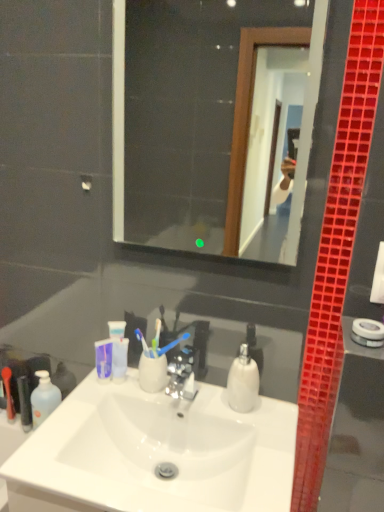
Question: Can you confirm if rubberized red toothbrush at lower left, which appears as the 1th toiletry when viewed from the left, is shorter than black plastic tube at left, the 1th toiletry when ordered from right to left?

Choices:
 (A) no
 (B) yes

Answer: (B)

Question: Can you confirm if rubberized red toothbrush at lower left, marked as the 2th toiletry in a right-to-left arrangement, is thinner than black plastic tube at left, the second toiletry viewed from the left?

Choices:
 (A) no
 (B) yes

Answer: (B)

Question: Are rubberized red toothbrush at lower left, which appears as the 1th toiletry when viewed from the left, and black plastic tube at left, the 1th toiletry when ordered from right to left, making contact?

Choices:
 (A) yes
 (B) no

Answer: (A)

Question: Does rubberized red toothbrush at lower left, marked as the 2th toiletry in a right-to-left arrangement, appear on the right side of black plastic tube at left, the 1th toiletry when ordered from right to left?

Choices:
 (A) yes
 (B) no

Answer: (B)

Question: Is rubberized red toothbrush at lower left, which appears as the 1th toiletry when viewed from the left, looking in the opposite direction of black plastic tube at left, the 1th toiletry when ordered from right to left?

Choices:
 (A) yes
 (B) no

Answer: (B)

Question: From a real-world perspective, is rubberized red toothbrush at lower left, marked as the 2th toiletry in a right-to-left arrangement, positioned under black plastic tube at left, the 1th toiletry when ordered from right to left, based on gravity?

Choices:
 (A) no
 (B) yes

Answer: (B)

Question: Considering the relative positions of white plastic towel bar at right and transparent glass mirror at upper center in the image provided, is white plastic towel bar at right to the right of transparent glass mirror at upper center from the viewer's perspective?

Choices:
 (A) no
 (B) yes

Answer: (B)

Question: Is white plastic towel bar at right not near transparent glass mirror at upper center?

Choices:
 (A) yes
 (B) no

Answer: (A)

Question: Is white plastic towel bar at right in contact with transparent glass mirror at upper center?

Choices:
 (A) yes
 (B) no

Answer: (B)

Question: Is white plastic towel bar at right thinner than transparent glass mirror at upper center?

Choices:
 (A) no
 (B) yes

Answer: (A)

Question: Does white plastic towel bar at right have a smaller size compared to transparent glass mirror at upper center?

Choices:
 (A) no
 (B) yes

Answer: (B)

Question: From a real-world perspective, is white plastic towel bar at right positioned under transparent glass mirror at upper center based on gravity?

Choices:
 (A) yes
 (B) no

Answer: (A)

Question: From a real-world perspective, is black plastic tube at left, the second toiletry viewed from the left, beneath white glossy soap dispenser at center?

Choices:
 (A) no
 (B) yes

Answer: (B)